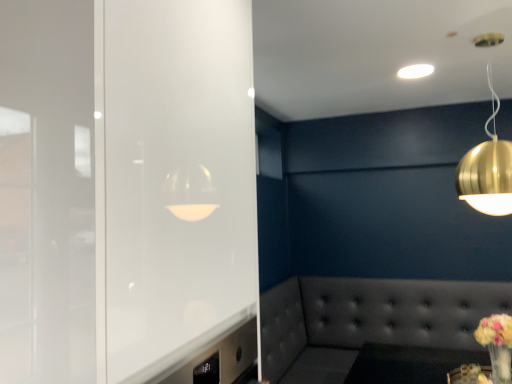
Where is `free point above gold metallic sphere at upper right, the first lamp in the bottom-to-top sequence (from a real-world perspective)`? This screenshot has width=512, height=384. free point above gold metallic sphere at upper right, the first lamp in the bottom-to-top sequence (from a real-world perspective) is located at coordinates (482, 36).